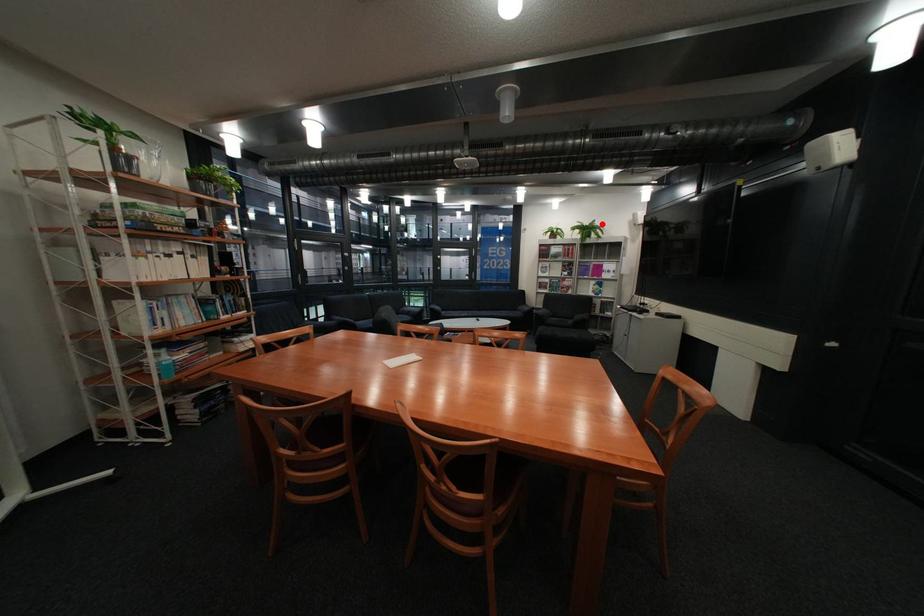
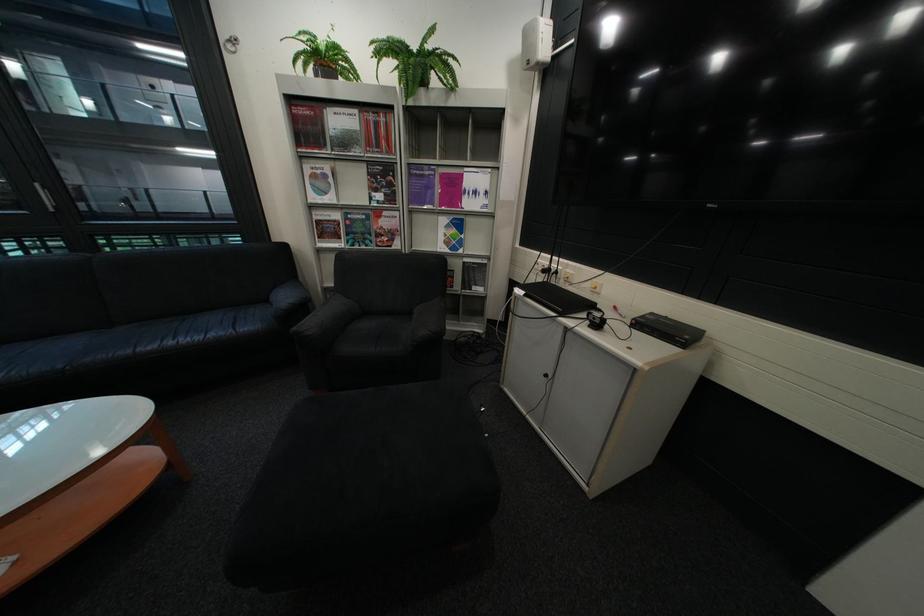
Find the pixel in the second image that matches the highlighted location in the first image.

(430, 46)